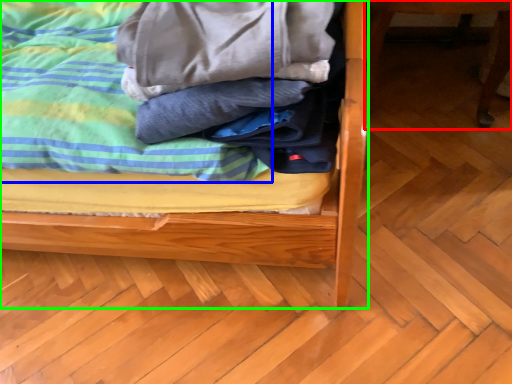
Question: Which object is positioned closest to furniture (highlighted by a red box)? Select from blanket (highlighted by a blue box) and bed (highlighted by a green box).

Choices:
 (A) blanket
 (B) bed

Answer: (B)